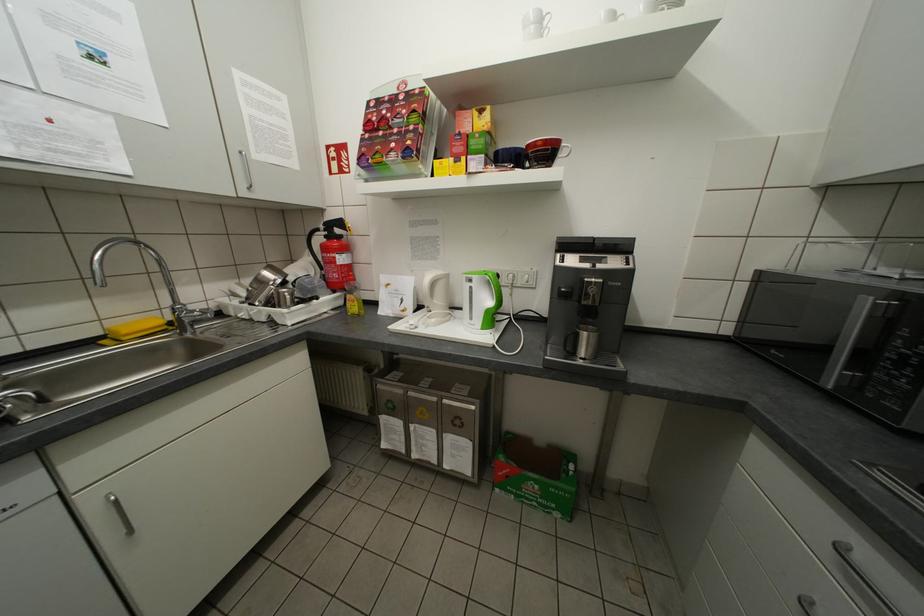
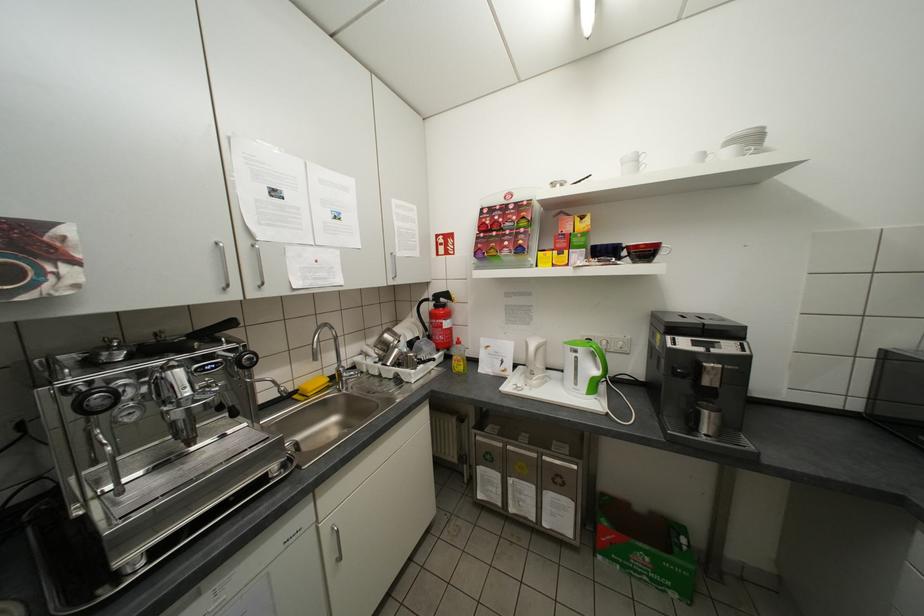
Where in the second image is the point corresponding to the point at 590,359 from the first image?

(714, 436)